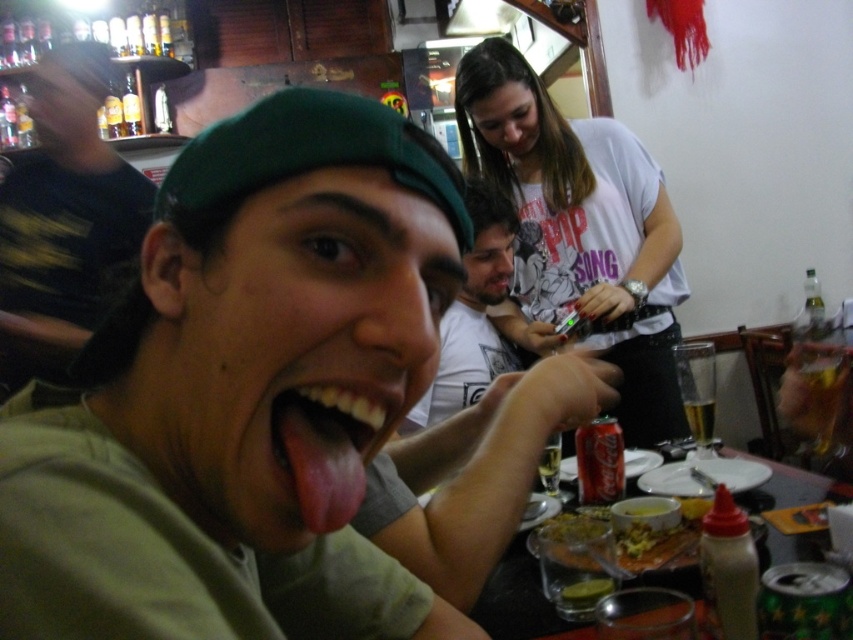
You are a photographer trying to capture a clear shot of both the white cotton shirt at upper center and the green fabric cap at upper left. Based on their sizes in the frame, which object should you adjust your camera focus on first to ensure both are in focus?

The white cotton shirt at upper center is smaller than the green fabric cap at upper left, so you should focus on the green fabric cap at upper left first since it is larger and might be easier to capture clearly before adjusting for the smaller white cotton shirt at upper center.